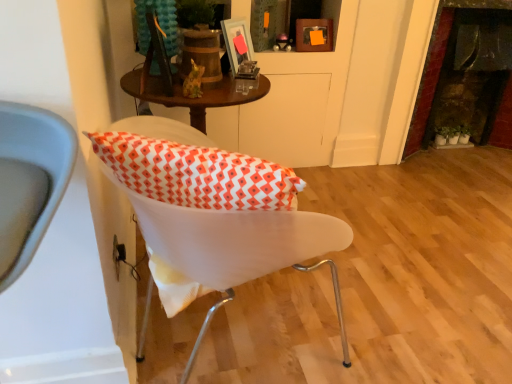
Image resolution: width=512 pixels, height=384 pixels. I want to click on white plastic chair at center, so point(253,260).

Which object is positioned more to the left, wooden picture frame at upper center, marked as the 3th picture frame in a left-to-right arrangement, or green matte plant at right?

wooden picture frame at upper center, marked as the 3th picture frame in a left-to-right arrangement, is more to the left.

Which is less distant, (x=312, y=48) or (x=454, y=126)?

Point (x=312, y=48) appears to be closer to the viewer than point (x=454, y=126).

How far apart are wooden picture frame at upper center, which appears as the 1th picture frame when viewed from the right, and green matte plant at right?

wooden picture frame at upper center, which appears as the 1th picture frame when viewed from the right, and green matte plant at right are 1.35 meters apart.

Considering the sizes of objects wooden picture frame at upper center, which appears as the 1th picture frame when viewed from the right, and green matte plant at right in the image provided, who is thinner, wooden picture frame at upper center, which appears as the 1th picture frame when viewed from the right, or green matte plant at right?

wooden picture frame at upper center, which appears as the 1th picture frame when viewed from the right, is thinner.

Considering the points (320, 22) and (174, 242), which point is behind, point (320, 22) or point (174, 242)?

The point (320, 22) is farther.

How many degrees apart are the facing directions of wooden picture frame at upper center, which is counted as the first picture frame, starting from the back, and white plastic chair at center?

They differ by 97.6 degrees in their facing directions.

Which is more to the right, wooden picture frame at upper center, which is the third picture frame in front-to-back order, or white plastic chair at center?

Positioned to the right is wooden picture frame at upper center, which is the third picture frame in front-to-back order.

Is dark stone fireplace at right with matte glass picture frame at upper center, which is the second picture frame in back-to-front order?

dark stone fireplace at right and matte glass picture frame at upper center, which is the second picture frame in back-to-front order, are not in contact.

Considering the sizes of objects dark stone fireplace at right and matte glass picture frame at upper center, which is the second picture frame in back-to-front order, in the image provided, who is bigger, dark stone fireplace at right or matte glass picture frame at upper center, which is the second picture frame in back-to-front order,?

dark stone fireplace at right.

Is dark stone fireplace at right to the right of matte glass picture frame at upper center, which is the second picture frame in back-to-front order, from the viewer's perspective?

Yes, dark stone fireplace at right is to the right of matte glass picture frame at upper center, which is the second picture frame in back-to-front order.

Which object is further away from the camera taking this photo, dark stone fireplace at right or matte glass picture frame at upper center, which is the 2th picture frame in left-to-right order?

Positioned behind is dark stone fireplace at right.

From the image's perspective, does white plastic chair at center appear higher than green matte plant at right?

No, from the image's perspective, white plastic chair at center is not above green matte plant at right.

Does white plastic chair at center have a lesser height compared to green matte plant at right?

In fact, white plastic chair at center may be taller than green matte plant at right.

Is point (158, 224) positioned before point (454, 144)?

Yes, it is in front of point (454, 144).

Which object is closer to the camera, white plastic chair at center or green matte plant at right?

white plastic chair at center is more forward.

Is the surface of green matte plant at right in direct contact with wooden picture frame at upper center, which is the third picture frame in front-to-back order?

They are not placed beside each other.

Is point (455, 134) closer or farther from the camera than point (307, 33)?

Clearly, point (455, 134) is more distant from the camera than point (307, 33).

How different are the orientations of green matte plant at right and wooden picture frame at upper center, which is counted as the first picture frame, starting from the back, in degrees?

The angle between the facing direction of green matte plant at right and the facing direction of wooden picture frame at upper center, which is counted as the first picture frame, starting from the back, is 1.76 degrees.

Is green matte plant at right thinner than wooden picture frame at upper center, which is counted as the first picture frame, starting from the back?

No.

Does green matte plant at right have a greater width compared to matte glass picture frame at upper center, which is the 2th picture frame in left-to-right order?

Indeed, green matte plant at right has a greater width compared to matte glass picture frame at upper center, which is the 2th picture frame in left-to-right order.

Is green matte plant at right with matte glass picture frame at upper center, which ranks as the second picture frame in right-to-left order?

green matte plant at right is not next to matte glass picture frame at upper center, which ranks as the second picture frame in right-to-left order, and they're not touching.

Identify the location of the 2nd picture frame to the left when counting from the green matte plant at right. (237, 43).

Considering the relative sizes of green matte plant at right and matte glass picture frame at upper center, which is the second picture frame in back-to-front order, in the image provided, is green matte plant at right shorter than matte glass picture frame at upper center, which is the second picture frame in back-to-front order,?

Correct, green matte plant at right is not as tall as matte glass picture frame at upper center, which is the second picture frame in back-to-front order.

Is wooden picture frame at upper center, which is the third picture frame in front-to-back order, next to dark stone fireplace at right?

They are not placed beside each other.

Is wooden picture frame at upper center, which is counted as the first picture frame, starting from the back, facing towards dark stone fireplace at right?

No, wooden picture frame at upper center, which is counted as the first picture frame, starting from the back, is not aimed at dark stone fireplace at right.

Considering the sizes of wooden picture frame at upper center, marked as the 3th picture frame in a left-to-right arrangement, and dark stone fireplace at right in the image, is wooden picture frame at upper center, marked as the 3th picture frame in a left-to-right arrangement, taller or shorter than dark stone fireplace at right?

In the image, wooden picture frame at upper center, marked as the 3th picture frame in a left-to-right arrangement, appears to be shorter than dark stone fireplace at right.

Image resolution: width=512 pixels, height=384 pixels. I want to click on the 1st picture frame in front when counting from the green matte plant at right, so click(x=314, y=35).

I want to click on the 3rd picture frame behind when counting from the white plastic chair at center, so click(314, 35).

Based on their spatial positions, is metallic silver picture frame at upper center, which is the third picture frame in back-to-front order, or green matte plant at right closer to wooden picture frame at upper center, marked as the 3th picture frame in a left-to-right arrangement?

Among the two, metallic silver picture frame at upper center, which is the third picture frame in back-to-front order, is located nearer to wooden picture frame at upper center, marked as the 3th picture frame in a left-to-right arrangement.

Based on the photo, considering their positions, is wooden picture frame at upper center, marked as the 3th picture frame in a left-to-right arrangement, positioned further to dark stone fireplace at right than white plastic chair at center?

white plastic chair at center is further to dark stone fireplace at right.

Which object lies nearer to the anchor point green matte plant at right, matte glass picture frame at upper center, which is the 2th picture frame in left-to-right order, or white plastic chair at center?

Among the two, matte glass picture frame at upper center, which is the 2th picture frame in left-to-right order, is located nearer to green matte plant at right.

From the image, which object appears to be nearer to wooden picture frame at upper center, which appears as the 1th picture frame when viewed from the right, dark stone fireplace at right or matte glass picture frame at upper center, which is the second picture frame in back-to-front order?

matte glass picture frame at upper center, which is the second picture frame in back-to-front order, lies closer to wooden picture frame at upper center, which appears as the 1th picture frame when viewed from the right, than the other object.

Considering their positions, is green matte plant at right positioned closer to matte glass picture frame at upper center, the second picture frame in the front-to-back sequence, than dark stone fireplace at right?

Among the two, dark stone fireplace at right is located nearer to matte glass picture frame at upper center, the second picture frame in the front-to-back sequence.

Estimate the real-world distances between objects in this image. Which object is closer to white plastic chair at center, wooden picture frame at upper center, which is counted as the first picture frame, starting from the back, or metallic silver picture frame at upper center, which is the 1th picture frame in left-to-right order?

Based on the image, metallic silver picture frame at upper center, which is the 1th picture frame in left-to-right order, appears to be nearer to white plastic chair at center.

Estimate the real-world distances between objects in this image. Which object is further from wooden picture frame at upper center, which is counted as the first picture frame, starting from the back, green matte plant at right or matte glass picture frame at upper center, which ranks as the second picture frame in right-to-left order?

The object further to wooden picture frame at upper center, which is counted as the first picture frame, starting from the back, is green matte plant at right.

Looking at the image, which one is located further to white plastic chair at center, metallic silver picture frame at upper center, which is the third picture frame in back-to-front order, or matte glass picture frame at upper center, which is the second picture frame in back-to-front order?

matte glass picture frame at upper center, which is the second picture frame in back-to-front order, is further to white plastic chair at center.

In order to click on plant between metallic silver picture frame at upper center, which is the first picture frame in front-to-back order, and dark stone fireplace at right in this screenshot , I will do `click(452, 134)`.

Where is `picture frame between matte glass picture frame at upper center, which ranks as the second picture frame in right-to-left order, and green matte plant at right`? picture frame between matte glass picture frame at upper center, which ranks as the second picture frame in right-to-left order, and green matte plant at right is located at coordinates (314, 35).

Locate an element on the screen. Image resolution: width=512 pixels, height=384 pixels. plant situated between wooden picture frame at upper center, which is counted as the first picture frame, starting from the back, and dark stone fireplace at right from left to right is located at coordinates (452, 134).

Identify the location of picture frame between white plastic chair at center and matte glass picture frame at upper center, which ranks as the second picture frame in right-to-left order, along the z-axis. The width and height of the screenshot is (512, 384). (157, 55).